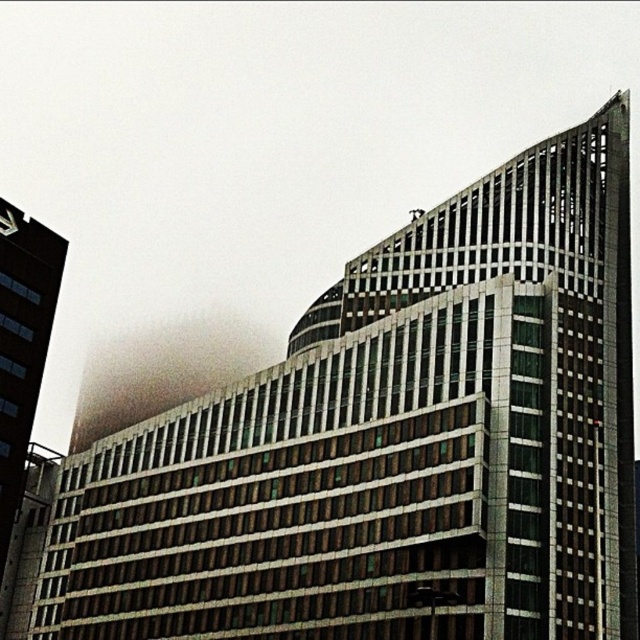
Does foggy translucent cloud at upper center have a smaller size compared to brown brick building at left?

No.

Is foggy translucent cloud at upper center positioned behind brown brick building at left?

Yes, it is behind brown brick building at left.

Is point (188, 317) less distant than point (3, 500)?

No.

Locate an element on the screen. This screenshot has width=640, height=640. foggy translucent cloud at upper center is located at coordinates (163, 371).